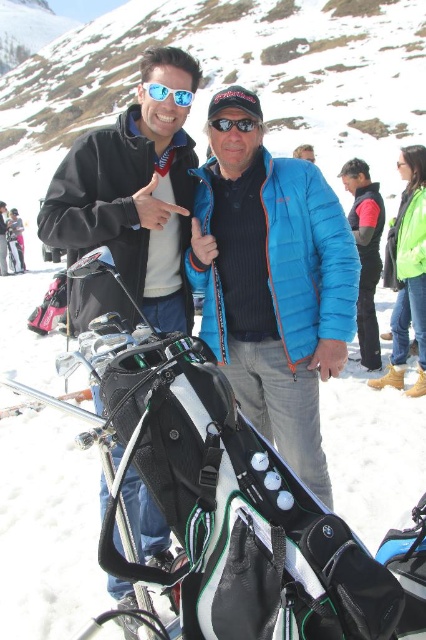
You are trying to identify two people in the scene. The first person is wearing a blue quilted jacket at center, and the second is wearing a blue quilted jacket at right. Which of these two jackets is positioned more to the left side of the image?

The blue quilted jacket at center is positioned to the left of the blue quilted jacket at right, making it the one more to the left side of the image.

You are a photographer trying to capture a photo of both the green matte jacket at right and the black matte sunglasses at center. Since you want to ensure both are in frame, can you determine which object is positioned further to the right?

The green matte jacket at right is positioned to the right of the black matte sunglasses at center, so the green matte jacket at right is further to the right.

You are standing in the snowy mountain area and see the blue quilted jacket at center and the green matte jacket at right. Which one is located to the left of the other?

The blue quilted jacket at center is positioned on the left side of green matte jacket at right.